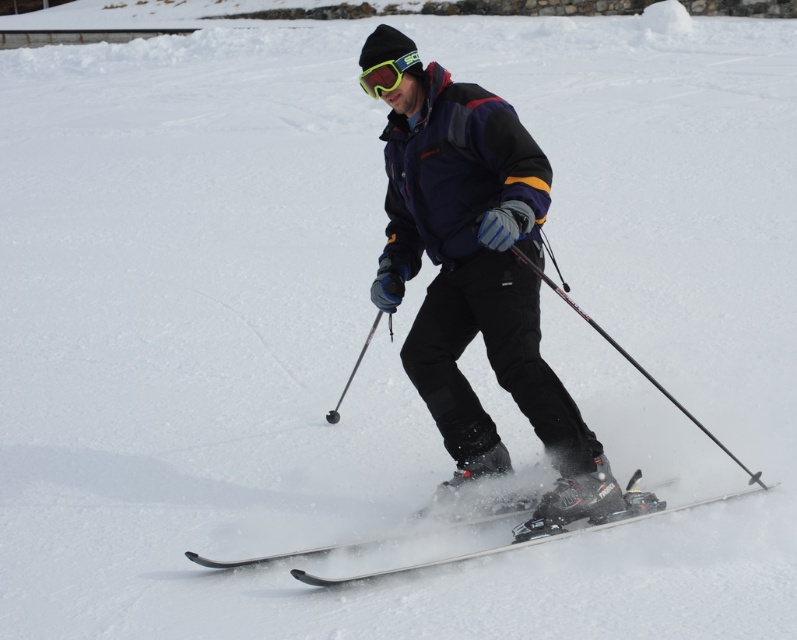
You are a photographer trying to capture the skier in the image. You notice a specific point at coordinates [633,362]. Based on the scene description, can you identify which object this point is located on?

The point at coordinates [633,362] is on the black textured ski pole at center.

You are a ski instructor preparing to demonstrate proper equipment positioning. You need to ensure the distance between the white glossy skis at center and the black textured ski pole at center is within safety guidelines. According to regulations, the minimum safe distance between skis and poles must be at least 30 inches. Is the current distance compliant with safety standards?

The distance between the white glossy skis at center and the black textured ski pole at center is 29.98 inches, which is slightly less than the required 30 inches. Therefore, the current distance does not comply with safety standards and needs adjustment.